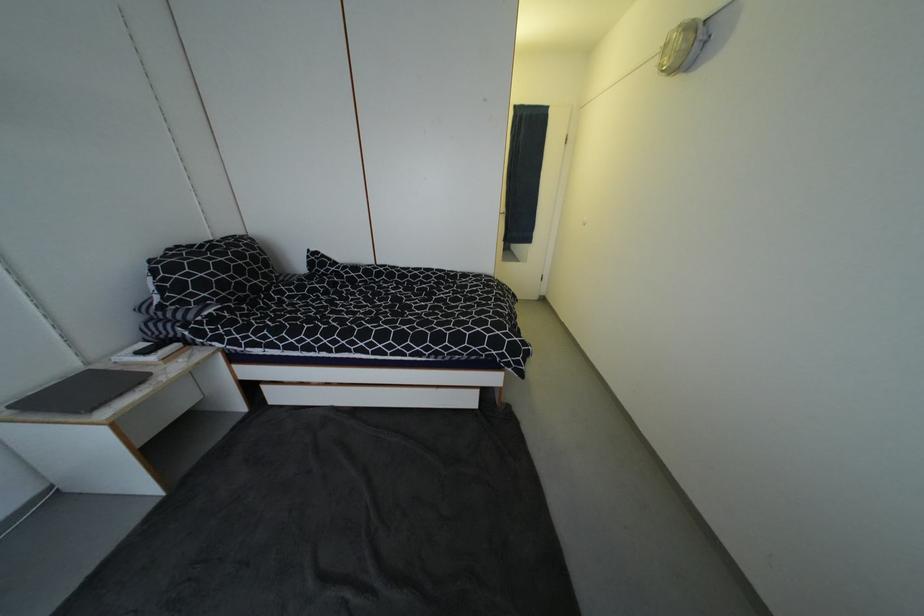
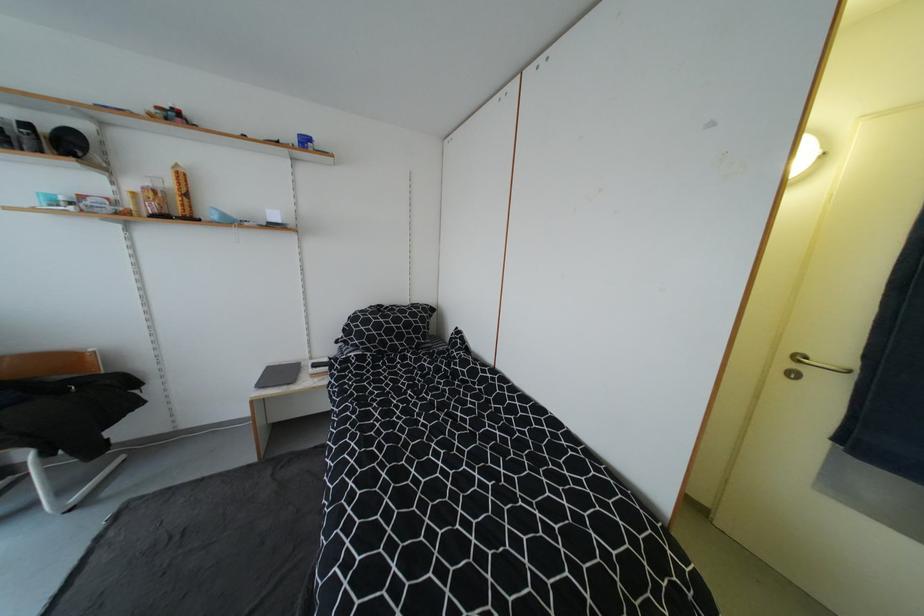
The point at (86, 394) is marked in the first image. Where is the corresponding point in the second image?

(286, 376)